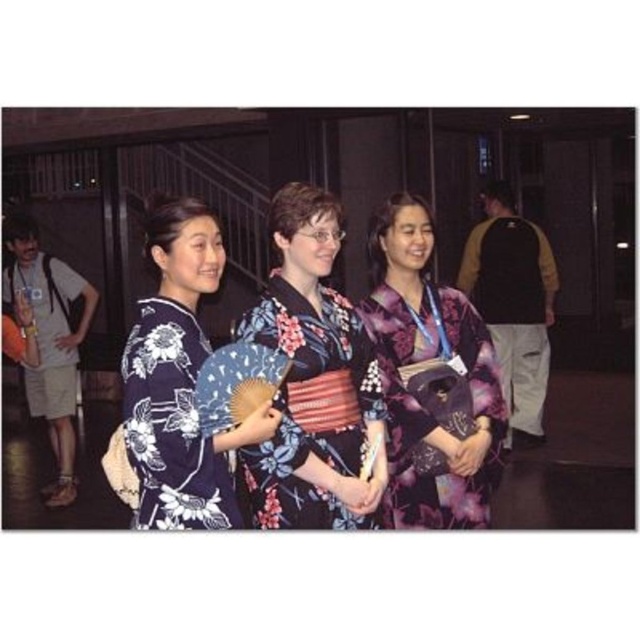
Consider the image. You are at a cultural event and notice two people wearing floral silk kimonos. The person wearing the floral silk kimono at left is standing to the left of the floral silk kimono at center. Which kimono is closer to the right side of the group?

The floral silk kimono at center is positioned on the right side of the floral silk kimono at left, so it is closer to the right side of the group.

You are at a traditional Japanese event and need to pass between the floral silk kimono at left and the floral silk kimono at center. The path between them is 3 meters wide. Can you walk through it comfortably?

The distance between the floral silk kimono at left and the floral silk kimono at center is 3.16 meters. Since the path is 3 meters wide, you can walk through comfortably as there is enough space.